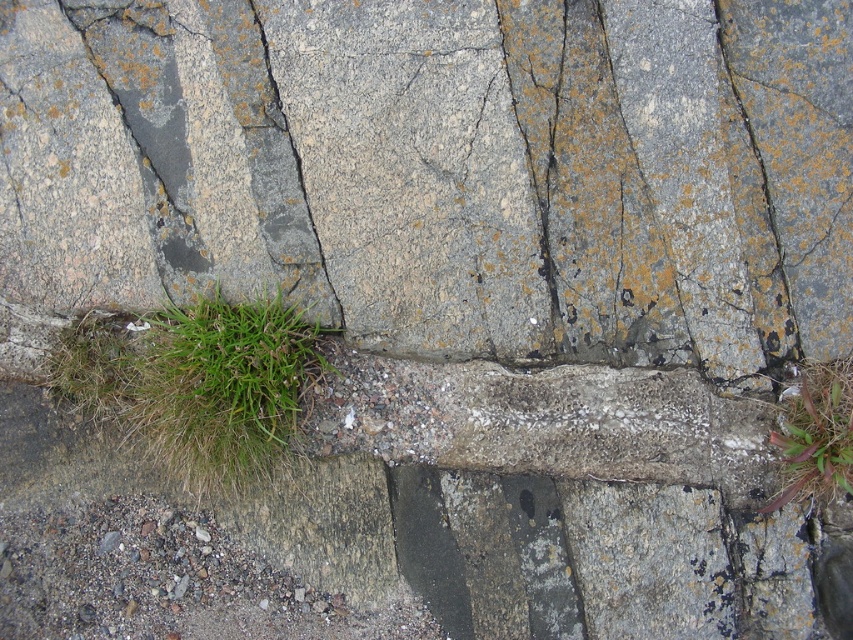
Can you confirm if green grass at lower left is smaller than green grass at lower right?

No, green grass at lower left is not smaller than green grass at lower right.

Which is behind, point (189, 364) or point (817, 472)?

The point (189, 364) is behind.

Image resolution: width=853 pixels, height=640 pixels. What are the coordinates of `green grass at lower left` in the screenshot? It's located at (196, 384).

Can you confirm if gray rough stone at center is thinner than green grass at lower right?

Incorrect, gray rough stone at center's width is not less than green grass at lower right's.

Is gray rough stone at center bigger than green grass at lower right?

Correct, gray rough stone at center is larger in size than green grass at lower right.

Is point (755, 326) closer to viewer compared to point (775, 433)?

No, it is behind (775, 433).

Image resolution: width=853 pixels, height=640 pixels. What are the coordinates of `gray rough stone at center` in the screenshot? It's located at (445, 168).

Is gray rough stone at center closer to the viewer compared to green grass at lower left?

Yes, gray rough stone at center is closer to the viewer.

Does point (445, 298) come in front of point (281, 368)?

No, it is behind (281, 368).

Identify the location of gray rough stone at center. (445, 168).